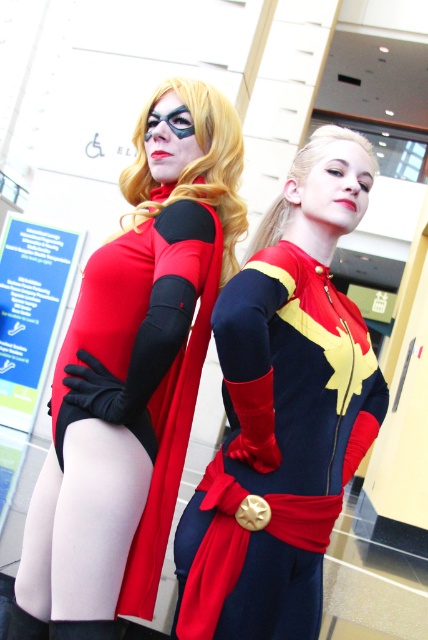
You are a photographer standing in front of the matte black bodysuit at left. You want to take a closeup photo of it without getting too close. If your camera has a maximum zoom range of 10 feet, will you be able to take the photo from your current position?

The matte black bodysuit at left and viewer are 4.93 feet apart from each other, which is within the camera maximum zoom range of 10 feet. So yes, you can take the photo from your current position.

You are a photographer trying to position two superheroes for a photo shoot. The superheroes are wearing a red bodysuit with black arm sleeves and flowing red cape at right and a matte black bodysuit at left. Based on their positions, which superhero is closer to the camera?

The matte black bodysuit at left is closer to the camera because its 2D location at point (133,372) places it nearer in the frame compared to the other superhero.

You are a photographer setting up for a superhero photo shoot. You need to ensure that both the matte black bodysuit at left and the matte red cape at center are visible in the frame. Given their sizes, which object should you focus on first to ensure proper framing?

The matte black bodysuit at left is taller than the matte red cape at center, so you should focus on the matte black bodysuit at left first to ensure proper framing.